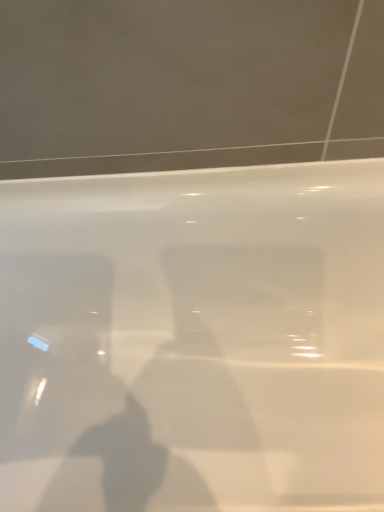
Question: Should I look upward or downward to see white glossy car at center?

Choices:
 (A) down
 (B) up

Answer: (A)